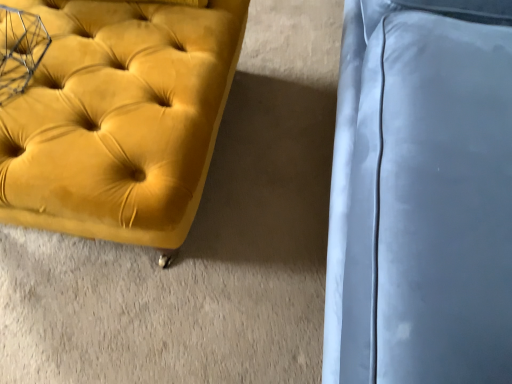
Question: Is satin blue cushion at right to the right of velvet yellow ottoman at left from the viewer's perspective?

Choices:
 (A) no
 (B) yes

Answer: (B)

Question: Is satin blue cushion at right positioned with its back to velvet yellow ottoman at left?

Choices:
 (A) yes
 (B) no

Answer: (B)

Question: Considering the relative sizes of satin blue cushion at right and velvet yellow ottoman at left in the image provided, is satin blue cushion at right thinner than velvet yellow ottoman at left?

Choices:
 (A) no
 (B) yes

Answer: (B)

Question: From the image's perspective, is satin blue cushion at right located beneath velvet yellow ottoman at left?

Choices:
 (A) no
 (B) yes

Answer: (A)

Question: Does satin blue cushion at right lie behind velvet yellow ottoman at left?

Choices:
 (A) yes
 (B) no

Answer: (B)

Question: Does satin blue cushion at right touch velvet yellow ottoman at left?

Choices:
 (A) no
 (B) yes

Answer: (A)

Question: Is velvet yellow ottoman at left closer to camera compared to satin blue cushion at right?

Choices:
 (A) no
 (B) yes

Answer: (A)

Question: Could satin blue cushion at right be considered to be inside velvet yellow ottoman at left?

Choices:
 (A) yes
 (B) no

Answer: (B)

Question: Considering the relative sizes of velvet yellow ottoman at left and satin blue cushion at right in the image provided, is velvet yellow ottoman at left wider than satin blue cushion at right?

Choices:
 (A) yes
 (B) no

Answer: (A)

Question: Can you confirm if velvet yellow ottoman at left is shorter than satin blue cushion at right?

Choices:
 (A) no
 (B) yes

Answer: (B)

Question: Is velvet yellow ottoman at left oriented towards satin blue cushion at right?

Choices:
 (A) yes
 (B) no

Answer: (B)

Question: Is velvet yellow ottoman at left at the left side of satin blue cushion at right?

Choices:
 (A) yes
 (B) no

Answer: (A)

Question: In terms of size, does satin blue cushion at right appear bigger or smaller than velvet yellow ottoman at left?

Choices:
 (A) small
 (B) big

Answer: (B)